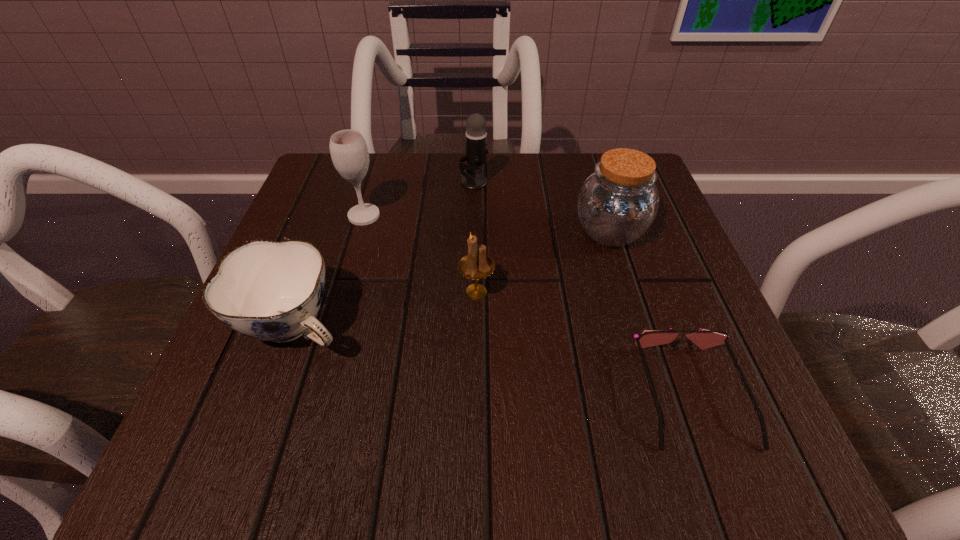
Locate an element on the screen. object located in the far right corner section of the desktop is located at coordinates (617, 204).

Where is `object that is at the near right corner`? This screenshot has width=960, height=540. object that is at the near right corner is located at coordinates click(x=704, y=339).

In the image, there is a desktop. What are the coordinates of `vacant space at the far edge` in the screenshot? It's located at (532, 179).

This screenshot has width=960, height=540. Identify the location of blank space at the left edge. (360, 241).

This screenshot has height=540, width=960. I want to click on vacant space at the right edge of the desktop, so click(x=660, y=389).

Identify the location of free space at the far left corner. The image size is (960, 540). (373, 153).

Find the location of a particular element. free location at the far right corner is located at coordinates (600, 160).

Locate an element on the screen. vacant space at the near right corner is located at coordinates (749, 415).

Image resolution: width=960 pixels, height=540 pixels. I want to click on free spot between the candle holder and the chinaware, so click(x=386, y=309).

Identify the location of free spot between the wineglass and the microphone. Image resolution: width=960 pixels, height=540 pixels. (419, 199).